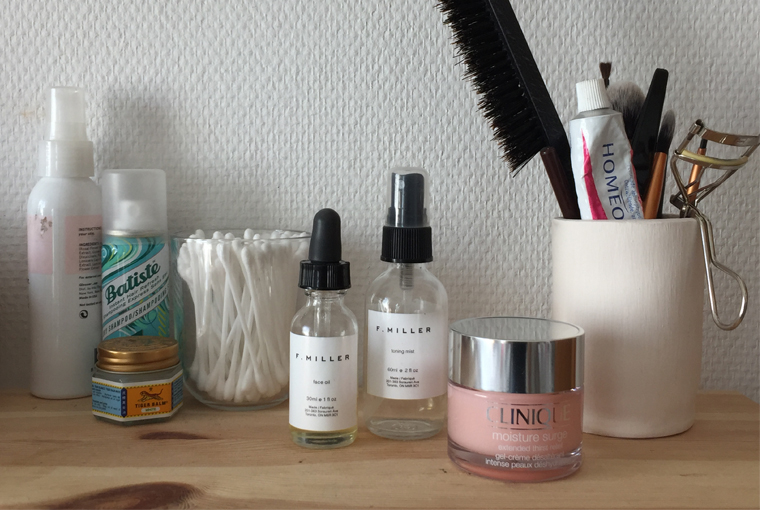
Locate an element on the screen. plastic spray bottle covers is located at coordinates (138, 206), (64, 123), (401, 194).